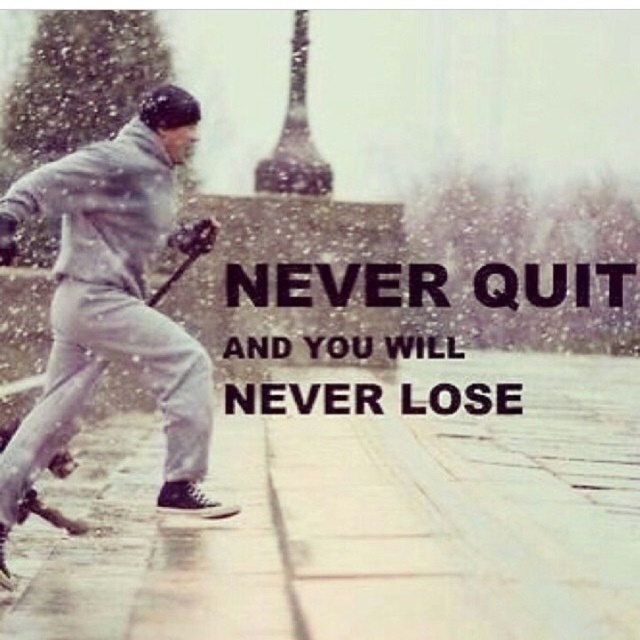
Question: Which point is closer to the camera taking this photo?

Choices:
 (A) (301, 124)
 (B) (172, 272)

Answer: (B)

Question: Among these objects, which one is nearest to the camera?

Choices:
 (A) shiny metallic eiffel tower at upper center
 (B) wooden bat at left
 (C) gray matte ski pants at left

Answer: (C)

Question: Is gray matte ski pants at left wider than wooden bat at left?

Choices:
 (A) yes
 (B) no

Answer: (B)

Question: Considering the real-world distances, which object is closest to the gray matte ski pants at left?

Choices:
 (A) wooden bat at left
 (B) shiny metallic eiffel tower at upper center

Answer: (A)

Question: Does gray matte ski pants at left appear on the left side of shiny metallic eiffel tower at upper center?

Choices:
 (A) no
 (B) yes

Answer: (B)

Question: Is shiny metallic eiffel tower at upper center to the right of wooden bat at left from the viewer's perspective?

Choices:
 (A) no
 (B) yes

Answer: (B)